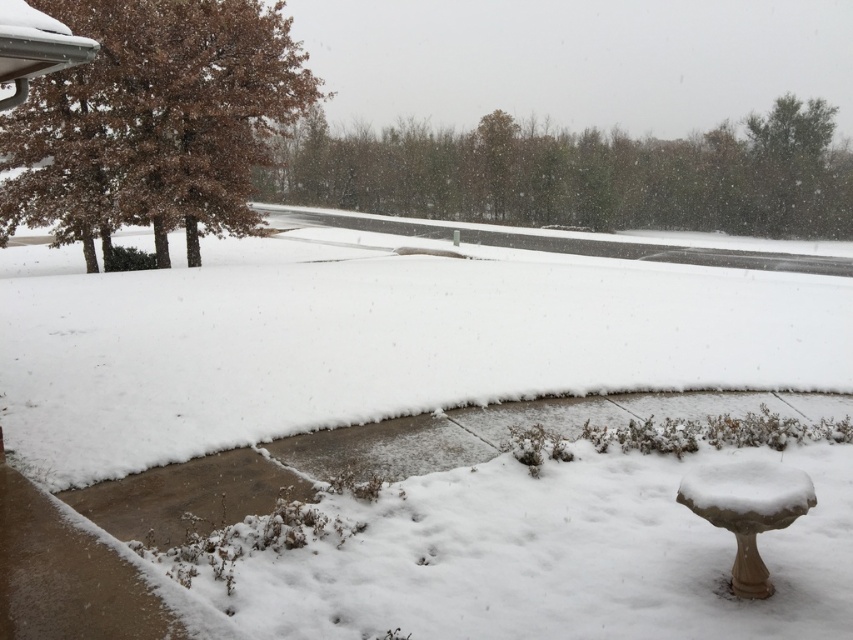
You are standing on the concrete patio and want to reach the white fluffy snow at center without stepping on any snow that has been melted or trodden upon. Is the distance you need to cover more than 20 feet?

→ The white fluffy snow at center is 19.80 feet away from viewer, so the distance is less than 20 feet. Therefore, you can reach it without exceeding 20 feet.

You are standing on the patio and want to walk to the white stone birdbath at lower right. Which direction should you move relative to the white fluffy snow at center?

You should move to the right relative to the white fluffy snow at center because the white stone birdbath at lower right is located to the right of it.

You are standing on the patio and want to place a small decorative snowman exactly at the center of the white fluffy snow at center. According to the coordinates provided, is the snowman placement feasible?

The white fluffy snow at center is located at point (376, 339), which is the exact center coordinates. Therefore, placing the snowman there is feasible as it aligns with the specified location.